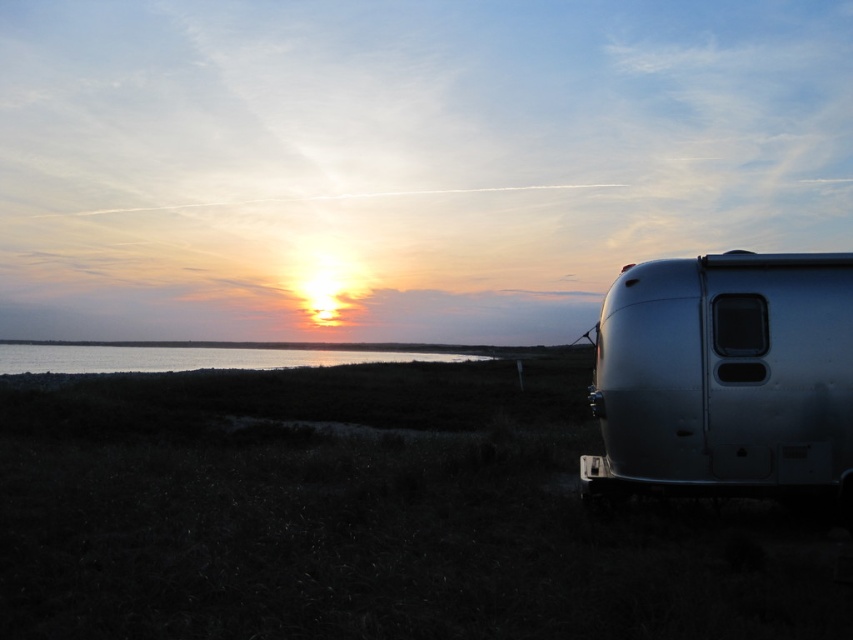
Does silver metallic trailer at right appear on the right side of silvery reflective water at lower left?

Correct, you'll find silver metallic trailer at right to the right of silvery reflective water at lower left.

Can you confirm if silver metallic trailer at right is positioned above silvery reflective water at lower left?

Yes, silver metallic trailer at right is above silvery reflective water at lower left.

Does point (694, 342) come behind point (338, 362)?

No, it is in front of (338, 362).

You are a GUI agent. You are given a task and a screenshot of the screen. Output one action in this format:
    pyautogui.click(x=<x>, y=<y>)
    Task: Click on the silver metallic trailer at right
    The width and height of the screenshot is (853, 640).
    Given the screenshot: What is the action you would take?
    pyautogui.click(x=726, y=378)